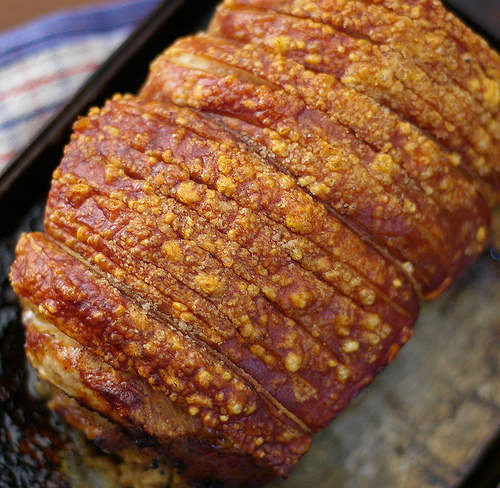
Where is `roasting pan`? This screenshot has width=500, height=488. roasting pan is located at coordinates (431, 422).